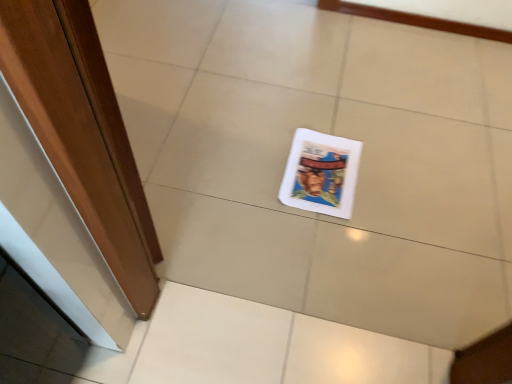
Image resolution: width=512 pixels, height=384 pixels. In order to click on free spot below white glossy magazine at center (from a real-world perspective) in this screenshot , I will do `click(323, 179)`.